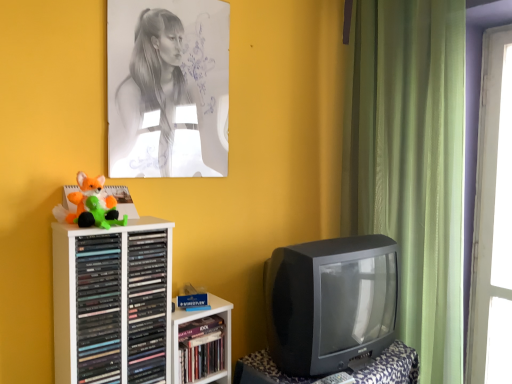
The height and width of the screenshot is (384, 512). Describe the element at coordinates (411, 162) in the screenshot. I see `green fabric curtain at right` at that location.

You are a GUI agent. You are given a task and a screenshot of the screen. Output one action in this format:
    pyautogui.click(x=<x>, y=<y>)
    Task: Click on the black plastic television at lower right
    Image resolution: width=512 pixels, height=384 pixels.
    Given the screenshot: What is the action you would take?
    pyautogui.click(x=391, y=367)

What do you see at coordinates (98, 308) in the screenshot? Image resolution: width=512 pixels, height=384 pixels. I see `matte black books at left, placed as the first book when sorted from left to right` at bounding box center [98, 308].

What is the approximate height of black matte cd case at left, placed as the 2th book when sorted from left to right?

→ It is 24.09 inches.

Where is `black matte cd case at left, placed as the 2th book when sorted from left to right`? This screenshot has width=512, height=384. black matte cd case at left, placed as the 2th book when sorted from left to right is located at coordinates [x=147, y=306].

Where is `gray paper portrait at upper center`? The height and width of the screenshot is (384, 512). gray paper portrait at upper center is located at coordinates (168, 88).

Measure the distance between green plush toy at left, which ranks as the first toy in bottom-to-top order, and camera.

green plush toy at left, which ranks as the first toy in bottom-to-top order, is 1.23 meters from camera.

Where is `green plush toy at left, the 2th toy viewed from the top`? The width and height of the screenshot is (512, 384). green plush toy at left, the 2th toy viewed from the top is located at coordinates (99, 213).

Where is `green fabric curtain at right`? The width and height of the screenshot is (512, 384). green fabric curtain at right is located at coordinates (411, 162).

Would you say black plastic television at right is part of green plush toy at left, which ranks as the first toy in bottom-to-top order,'s contents?

Actually, black plastic television at right is outside green plush toy at left, which ranks as the first toy in bottom-to-top order.

The width and height of the screenshot is (512, 384). In order to click on television below the green plush toy at left, which ranks as the first toy in bottom-to-top order (from a real-world perspective) in this screenshot , I will do `click(331, 302)`.

Is green plush toy at left, the 2th toy viewed from the top, next to black plastic television at right?

No, green plush toy at left, the 2th toy viewed from the top, is not next to black plastic television at right.

Is point (113, 323) in front of point (186, 368)?

That is True.

Which book is the 2nd one when counting from the front of the hardcover book at center, which ranks as the first book in right-to-left order? Please provide its 2D coordinates.

[(98, 308)]

Does matte black books at left, placed as the first book when sorted from left to right, have a lesser width compared to hardcover book at center, which ranks as the first book in right-to-left order?

Incorrect, the width of matte black books at left, placed as the first book when sorted from left to right, is not less than that of hardcover book at center, which ranks as the first book in right-to-left order.

From the image's perspective, is matte black books at left, which is the 3th book from right to left, on hardcover book at center, acting as the 3th book starting from the left?

Yes, from the image's perspective, matte black books at left, which is the 3th book from right to left, is over hardcover book at center, acting as the 3th book starting from the left.

How far apart are matte black books at left, placed as the first book when sorted from left to right, and black plastic television at lower right?

matte black books at left, placed as the first book when sorted from left to right, and black plastic television at lower right are 25.95 inches apart.

Does point (104, 353) lie in front of point (252, 364)?

Yes, it is.

Can you confirm if matte black books at left, which is the 3th book from right to left, is wider than black plastic television at lower right?

No.

Is matte black books at left, placed as the first book when sorted from left to right, smaller than black plastic television at lower right?

Yes.

Is matte black books at left, placed as the first book when sorted from left to right, to the left of green plush toy at left, which ranks as the first toy in bottom-to-top order, from the viewer's perspective?

Correct, you'll find matte black books at left, placed as the first book when sorted from left to right, to the left of green plush toy at left, which ranks as the first toy in bottom-to-top order.

Is matte black books at left, placed as the first book when sorted from left to right, taller than green plush toy at left, the 2th toy viewed from the top?

Yes, matte black books at left, placed as the first book when sorted from left to right, is taller than green plush toy at left, the 2th toy viewed from the top.

Can you tell me how much matte black books at left, placed as the first book when sorted from left to right, and green plush toy at left, which ranks as the first toy in bottom-to-top order, differ in facing direction?

matte black books at left, placed as the first book when sorted from left to right, and green plush toy at left, which ranks as the first toy in bottom-to-top order, are facing 0.000367 degrees away from each other.

From the image's perspective, is gray paper portrait at upper center above or below green plush toy at left, the 2th toy viewed from the top?

Clearly, from the image's perspective, gray paper portrait at upper center is above green plush toy at left, the 2th toy viewed from the top.

Does point (179, 132) come behind point (111, 195)?

Yes, it is behind point (111, 195).

Is gray paper portrait at upper center situated inside green plush toy at left, which ranks as the first toy in bottom-to-top order, or outside?

gray paper portrait at upper center is spatially situated outside green plush toy at left, which ranks as the first toy in bottom-to-top order.

Considering their positions, is gray paper portrait at upper center located in front of or behind green plush toy at left, the 2th toy viewed from the top?

In the image, gray paper portrait at upper center appears behind green plush toy at left, the 2th toy viewed from the top.

Can you confirm if black plastic television at right is positioned to the left of gray paper portrait at upper center?

Incorrect, black plastic television at right is not on the left side of gray paper portrait at upper center.

What's the angular difference between black plastic television at right and gray paper portrait at upper center's facing directions?

The facing directions of black plastic television at right and gray paper portrait at upper center are 0.00105 degrees apart.

The width and height of the screenshot is (512, 384). In order to click on television located underneath the gray paper portrait at upper center (from a real-world perspective) in this screenshot , I will do `click(331, 302)`.

Is black plastic television at right far from gray paper portrait at upper center?

black plastic television at right is actually quite close to gray paper portrait at upper center.

Looking at this image, which object is positioned more to the left, gray paper portrait at upper center or fluffy orange fox at left, which is counted as the 1th toy, starting from the top?

From the viewer's perspective, fluffy orange fox at left, which is counted as the 1th toy, starting from the top, appears more on the left side.

Consider the image. Can you confirm if gray paper portrait at upper center is bigger than fluffy orange fox at left, which is the 2th toy in bottom-to-top order?

Correct, gray paper portrait at upper center is larger in size than fluffy orange fox at left, which is the 2th toy in bottom-to-top order.

Is gray paper portrait at upper center wider than fluffy orange fox at left, which is counted as the 1th toy, starting from the top?

No, gray paper portrait at upper center is not wider than fluffy orange fox at left, which is counted as the 1th toy, starting from the top.

Based on the photo, is gray paper portrait at upper center closer to camera compared to fluffy orange fox at left, which is counted as the 1th toy, starting from the top?

No, it is behind fluffy orange fox at left, which is counted as the 1th toy, starting from the top.

The height and width of the screenshot is (384, 512). I want to click on the 1st toy positioned above the black plastic television at right (from a real-world perspective), so click(99, 213).

From the image's perspective, which book is the 2nd one below the matte black books at left, which is the 3th book from right to left? Please provide its 2D coordinates.

[(201, 348)]

When comparing their distances from white plastic shelf at left, does black matte cd case at left, placed as the 2th book when sorted from right to left, or gray paper portrait at upper center seem closer?

black matte cd case at left, placed as the 2th book when sorted from right to left, is closer to white plastic shelf at left.

Estimate the real-world distances between objects in this image. Which object is further from fluffy orange fox at left, which is the 2th toy in bottom-to-top order, black plastic television at lower right or white plastic shelf at left?

Based on the image, black plastic television at lower right appears to be further to fluffy orange fox at left, which is the 2th toy in bottom-to-top order.

Estimate the real-world distances between objects in this image. Which object is closer to matte black books at left, placed as the first book when sorted from left to right, green plush toy at left, the 2th toy viewed from the top, or white plastic shelf at left?

Based on the image, white plastic shelf at left appears to be nearer to matte black books at left, placed as the first book when sorted from left to right.

Considering their positions, is black matte cd case at left, placed as the 2th book when sorted from right to left, positioned further to gray paper portrait at upper center than green fabric curtain at right?

green fabric curtain at right is further to gray paper portrait at upper center.

From the image, which object appears to be nearer to black plastic television at lower right, gray paper portrait at upper center or fluffy orange fox at left, which is the 2th toy in bottom-to-top order?

The object closer to black plastic television at lower right is fluffy orange fox at left, which is the 2th toy in bottom-to-top order.

Looking at the image, which one is located further to hardcover book at center, acting as the 3th book starting from the left, fluffy orange fox at left, which is the 2th toy in bottom-to-top order, or black plastic television at lower right?

Among the two, fluffy orange fox at left, which is the 2th toy in bottom-to-top order, is located further to hardcover book at center, acting as the 3th book starting from the left.

From the picture: Based on their spatial positions, is green plush toy at left, the 2th toy viewed from the top, or black plastic television at right further from gray paper portrait at upper center?

black plastic television at right lies further to gray paper portrait at upper center than the other object.

Looking at the image, which one is located further to white plastic shelf at left, hardcover book at center, acting as the 3th book starting from the left, or gray paper portrait at upper center?

The object further to white plastic shelf at left is gray paper portrait at upper center.

The width and height of the screenshot is (512, 384). I want to click on shelf that lies between fluffy orange fox at left, which is counted as the 1th toy, starting from the top, and hardcover book at center, acting as the 3th book starting from the left, from top to bottom, so click(113, 302).

The image size is (512, 384). Identify the location of book between white plastic shelf at left and black matte cd case at left, placed as the 2th book when sorted from right to left, from front to back. (98, 308).

Identify the location of furniture between matte black books at left, placed as the first book when sorted from left to right, and green fabric curtain at right from left to right. (391, 367).

Identify the location of shelf between gray paper portrait at upper center and black plastic television at lower right vertically. (113, 302).